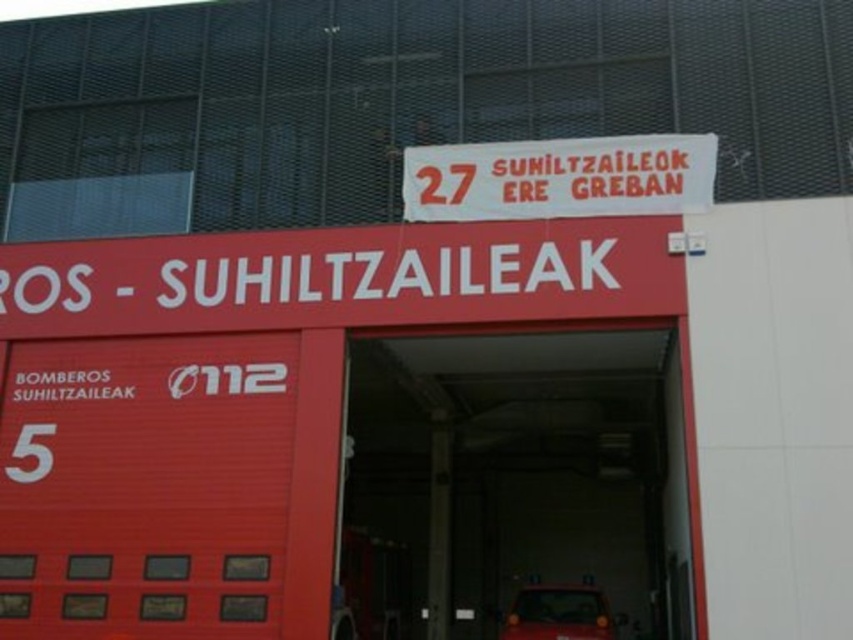
Is red matte garage door at center taller than metallic red car at center?

Yes, red matte garage door at center is taller than metallic red car at center.

Does point (432, 390) lie behind point (538, 627)?

Yes.

Locate an element on the screen. The height and width of the screenshot is (640, 853). red matte garage door at center is located at coordinates (515, 481).

Between white paper sign at center and metallic red car at center, which one appears on the left side from the viewer's perspective?

From the viewer's perspective, white paper sign at center appears more on the left side.

Which is above, white paper sign at center or metallic red car at center?

white paper sign at center is higher up.

The height and width of the screenshot is (640, 853). In order to click on white paper sign at center in this screenshot , I will do `click(560, 177)`.

I want to click on white paper sign at center, so click(560, 177).

Can you confirm if red matte garage door at center is positioned below white paper sign at center?

Yes.

Who is more forward, [573,506] or [486,212]?

Positioned in front is point [486,212].

What do you see at coordinates (515, 481) in the screenshot? This screenshot has width=853, height=640. I see `red matte garage door at center` at bounding box center [515, 481].

Where is `red matte garage door at center`? The height and width of the screenshot is (640, 853). red matte garage door at center is located at coordinates (515, 481).